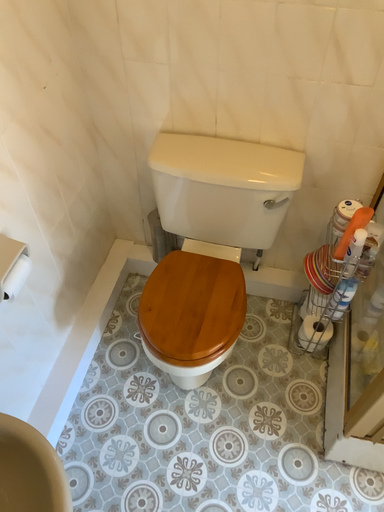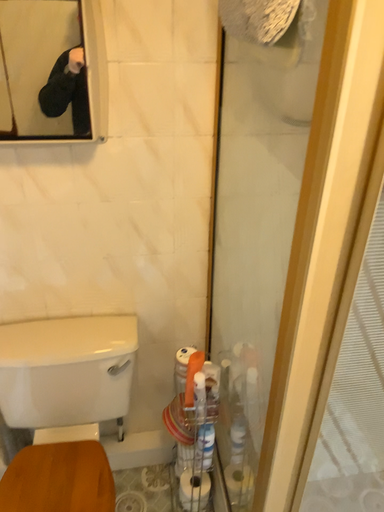
Question: Which way did the camera rotate in the video?

Choices:
 (A) rotated upward
 (B) rotated downward

Answer: (A)